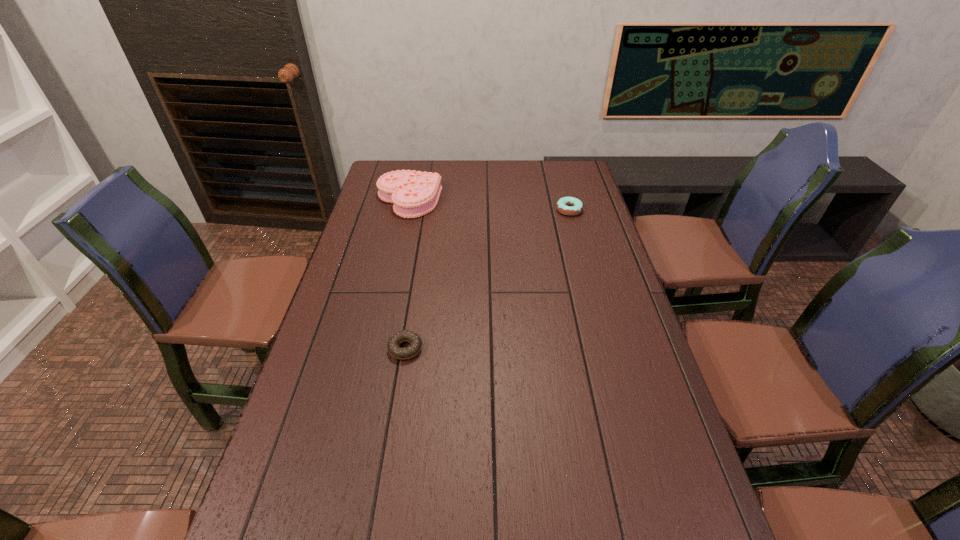
Locate an element on the screen. The image size is (960, 540). cake is located at coordinates (414, 194).

Find the location of a particular element. The width and height of the screenshot is (960, 540). the rightmost object is located at coordinates (570, 206).

Find the location of a particular element. This screenshot has width=960, height=540. the right doughnut is located at coordinates (570, 206).

I want to click on the nearest object, so click(x=415, y=341).

Image resolution: width=960 pixels, height=540 pixels. What are the coordinates of `the left doughnut` in the screenshot? It's located at (415, 341).

At what (x,y) coordinates should I click in order to perform the action: click on free space located on the right of the cake. Please return your answer as a coordinate pair (x, y). This screenshot has height=540, width=960. Looking at the image, I should click on (540, 200).

Locate an element on the screen. free point located 0.140m on the back of the rightmost object is located at coordinates (563, 184).

This screenshot has height=540, width=960. I want to click on free spot located 0.080m on the left of the nearest object, so click(x=358, y=349).

Where is `object at the far edge`? The height and width of the screenshot is (540, 960). object at the far edge is located at coordinates (414, 194).

At what (x,y) coordinates should I click in order to perform the action: click on object present at the left edge. Please return your answer as a coordinate pair (x, y). Looking at the image, I should click on (414, 194).